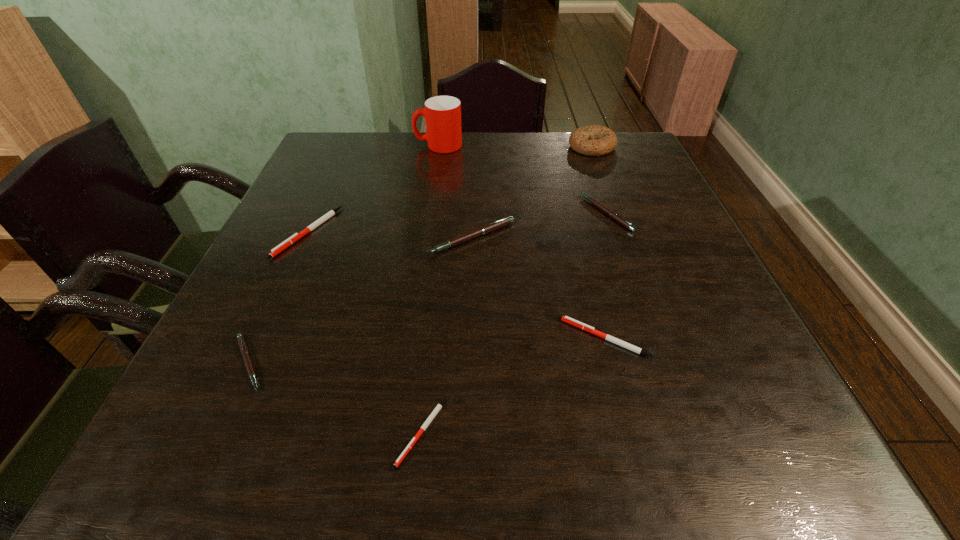
Where is `vacant area that satisfies the following two spatial constraints: 1. at the nib of the tallest pen; 2. at the nib of the nearest pink pen`? Image resolution: width=960 pixels, height=540 pixels. vacant area that satisfies the following two spatial constraints: 1. at the nib of the tallest pen; 2. at the nib of the nearest pink pen is located at coordinates (469, 363).